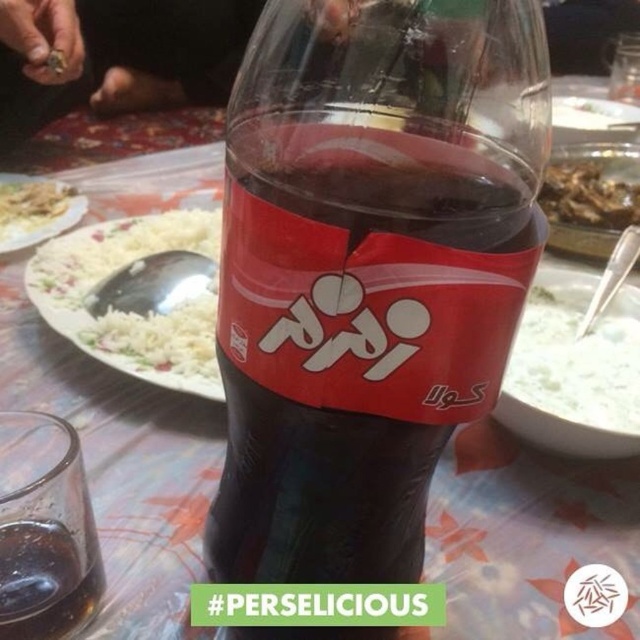
You are at a dinner table and notice the transparent glass at lower left and the white rice at upper left. Which object is closer to you?

The transparent glass at lower left is closer to you because it is positioned under the white rice at upper left, meaning it is lower in the image and thus nearer from the viewer perspective.

You are holding a camera and want to take a closeup photo of the matte plastic bottle at center. The camera requires the subject to be at least 6 inches away for optimal focus. Can you take the photo without moving the bottle?

The matte plastic bottle at center is 6.27 inches away from camera, which is just over the required 6 inches. Therefore, you can take the photo without moving the bottle.

You are setting up a table for a dinner party and need to place the transparent glass at lower left and the white rice at upper left. Which object has a smaller width?

The transparent glass at lower left is thinner than the white rice at upper left, so the transparent glass at lower left has a smaller width.